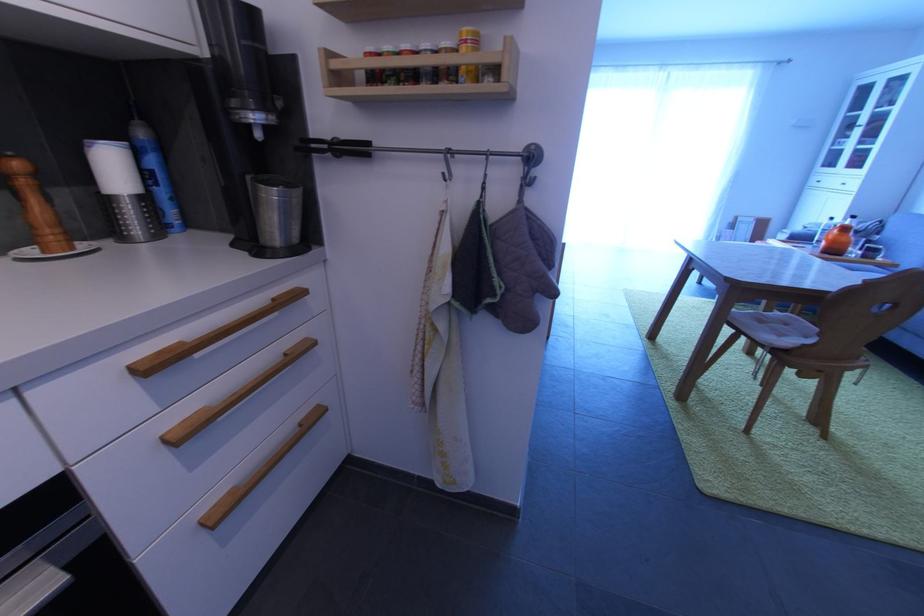
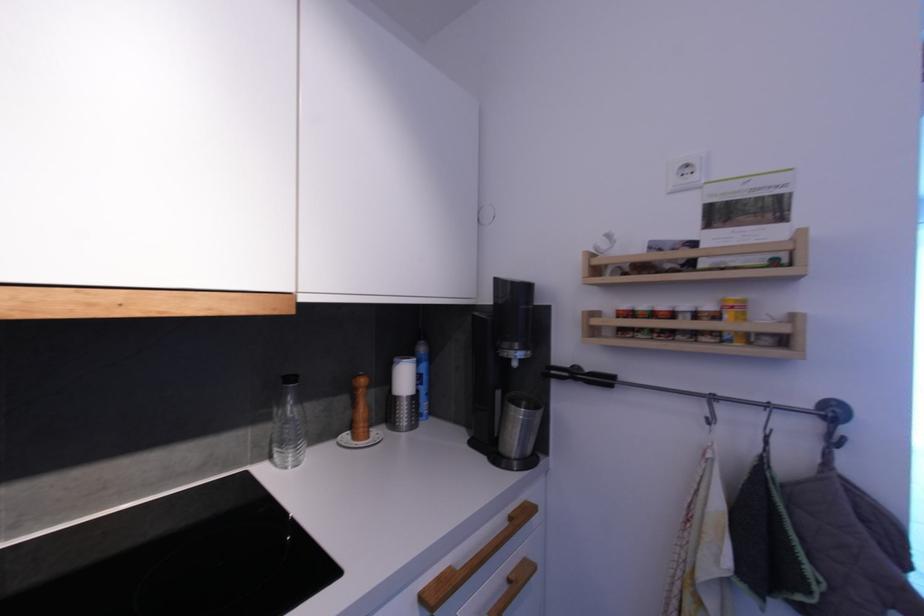
Where in the second image is the point corresponding to (278,302) from the first image?

(516, 519)